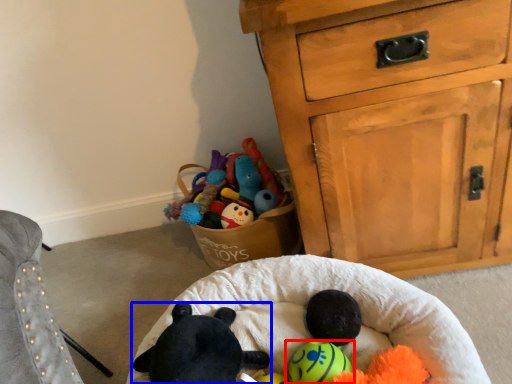
Question: Which object appears farthest to the camera in this image, toy (highlighted by a red box) or toy (highlighted by a blue box)?

Choices:
 (A) toy
 (B) toy

Answer: (A)